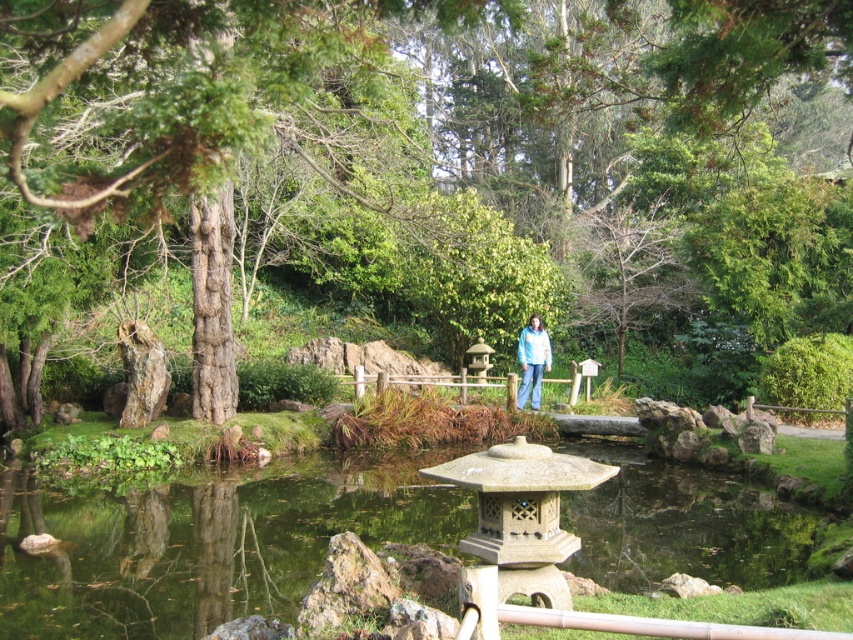
Is green textured tree at center closer to the viewer compared to blue fabric jacket at center?

That is True.

Which is in front, point (340, 248) or point (550, 364)?

Positioned in front is point (550, 364).

Image resolution: width=853 pixels, height=640 pixels. What are the coordinates of `green textured tree at center` in the screenshot? It's located at (444, 163).

Is green textured tree at center positioned at the back of clear water at pond center?

No, it is in front of clear water at pond center.

Between point (764, 304) and point (119, 612), which one is positioned in front?

Point (119, 612)

This screenshot has height=640, width=853. Find the location of `green textured tree at center`. green textured tree at center is located at coordinates (444, 163).

Where is `green textured tree at center`? The width and height of the screenshot is (853, 640). green textured tree at center is located at coordinates (444, 163).

Can you confirm if clear water at pond center is bigger than blue fabric jacket at center?

Yes, clear water at pond center is bigger than blue fabric jacket at center.

From the picture: Which is above, clear water at pond center or blue fabric jacket at center?

blue fabric jacket at center is higher up.

Where is `clear water at pond center`? Image resolution: width=853 pixels, height=640 pixels. clear water at pond center is located at coordinates (206, 540).

This screenshot has width=853, height=640. In order to click on clear water at pond center in this screenshot , I will do `click(206, 540)`.